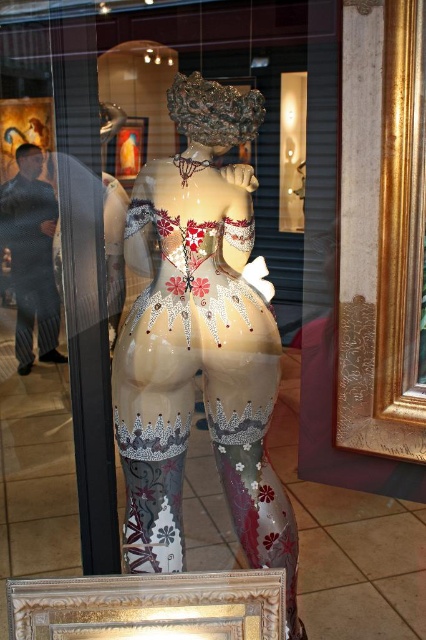
You are a window shopper passing by the store. You notice the glossy ceramic statue at center and the gold metallic picture frame at upper center in the store window. Which object is taller?

The glossy ceramic statue at center is much taller than the gold metallic picture frame at upper center.

You are a customer in a store and you want to buy both the glossy ceramic statue at center and the gold metallic picture frame at upper center. The store has a discount for items that are smaller than 10 inches. Which item are you more likely to get a discount for?

The gold metallic picture frame at upper center is more likely to qualify for the discount since it is smaller than the glossy ceramic statue at center, which is larger in size.

You are standing in front of the store window and notice the glossy ceramic statue at center. Can you determine its exact position based on the coordinates provided?

The glossy ceramic statue at center is located at point coordinates of (199, 342).